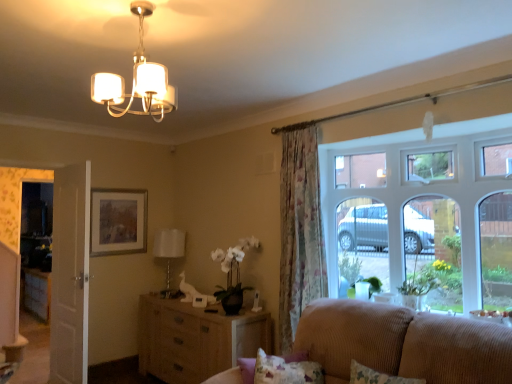
Identify the location of woven wood dresser at center. The height and width of the screenshot is (384, 512). 196,339.

What do you see at coordinates (118, 221) in the screenshot? This screenshot has width=512, height=384. I see `wooden picture frame at upper left` at bounding box center [118, 221].

What is the approximate height of matte white chandelier at upper center, the 2th lamp in the left-to-right sequence?

matte white chandelier at upper center, the 2th lamp in the left-to-right sequence, is 48.20 centimeters in height.

This screenshot has height=384, width=512. What are the coordinates of `clear glass window at center` in the screenshot? It's located at (401, 176).

Identify the location of transparent glass door at left. (36, 225).

Considering the relative sizes of white wooden door at left and clear glass window at center in the image provided, is white wooden door at left thinner than clear glass window at center?

Correct, the width of white wooden door at left is less than that of clear glass window at center.

Is white wooden door at left further to camera compared to clear glass window at center?

Yes.

Is white wooden door at left positioned beyond the bounds of clear glass window at center?

Yes.

Looking at this image, is white wooden door at left facing away from clear glass window at center?

No, white wooden door at left is not facing away from clear glass window at center.

From the picture: How different are the orientations of fluffy fabric pillow at lower right and matte white chandelier at upper center, the first lamp viewed from the top, in degrees?

94.2 degrees.

Visually, is fluffy fabric pillow at lower right positioned to the left or to the right of matte white chandelier at upper center, positioned as the 2th lamp in back-to-front order?

In the image, fluffy fabric pillow at lower right appears on the right side of matte white chandelier at upper center, positioned as the 2th lamp in back-to-front order.

Looking at this image, is matte white chandelier at upper center, the 2th lamp in the left-to-right sequence, surrounded by fluffy fabric pillow at lower right?

No.

From the image's perspective, is fluffy fabric pillow at lower right on matte white chandelier at upper center, the first lamp viewed from the top?

Incorrect, from the image's perspective, fluffy fabric pillow at lower right is lower than matte white chandelier at upper center, the first lamp viewed from the top.

This screenshot has height=384, width=512. I want to click on studio couch that is on the right side of wooden picture frame at upper left, so click(x=403, y=343).

How different are the orientations of beige corduroy couch at lower right and wooden picture frame at upper left in degrees?

The facing directions of beige corduroy couch at lower right and wooden picture frame at upper left are 89.8 degrees apart.

Is the depth of beige corduroy couch at lower right greater than that of wooden picture frame at upper left?

No, it is not.

Is beige corduroy couch at lower right shorter than wooden picture frame at upper left?

Incorrect, the height of beige corduroy couch at lower right does not fall short of that of wooden picture frame at upper left.

From the image's perspective, is transparent glass door at left above or below wooden picture frame at upper left?

Based on their image positions, transparent glass door at left is located beneath wooden picture frame at upper left.

Based on their sizes in the image, would you say transparent glass door at left is bigger or smaller than wooden picture frame at upper left?

transparent glass door at left is bigger than wooden picture frame at upper left.

Which of these two, transparent glass door at left or wooden picture frame at upper left, is wider?

transparent glass door at left is wider.

Which is in front, point (30, 217) or point (141, 204)?

The point (141, 204) is more forward.

Is beige corduroy couch at lower right at the left side of matte white chandelier at upper center, arranged as the second lamp when ordered from the bottom?

Incorrect, beige corduroy couch at lower right is not on the left side of matte white chandelier at upper center, arranged as the second lamp when ordered from the bottom.

Is point (226, 371) positioned before point (144, 109)?

No, it is behind (144, 109).

From the image's perspective, is beige corduroy couch at lower right above matte white chandelier at upper center, positioned as the 2th lamp in back-to-front order?

Actually, beige corduroy couch at lower right appears below matte white chandelier at upper center, positioned as the 2th lamp in back-to-front order, in the image.

Is beige corduroy couch at lower right positioned beyond the bounds of matte white chandelier at upper center, placed as the first lamp when sorted from front to back?

Yes, beige corduroy couch at lower right is outside of matte white chandelier at upper center, placed as the first lamp when sorted from front to back.

Is point (291, 148) positioned behind point (394, 383)?

Yes.

From a real-world perspective, is floral fabric curtain at center under fluffy fabric pillow at lower right?

Incorrect, from a real-world perspective, floral fabric curtain at center is higher than fluffy fabric pillow at lower right.

Is floral fabric curtain at center wider than fluffy fabric pillow at lower right?

Yes, floral fabric curtain at center is wider than fluffy fabric pillow at lower right.

Is fluffy fabric pillow at lower right at the back of floral fabric curtain at center?

That's not correct — floral fabric curtain at center is not looking away from fluffy fabric pillow at lower right.

How far apart are matte white chandelier at upper center, arranged as the second lamp when ordered from the bottom, and transparent glass door at left?

matte white chandelier at upper center, arranged as the second lamp when ordered from the bottom, is 3.56 meters away from transparent glass door at left.

Considering the relative positions of matte white chandelier at upper center, arranged as the second lamp when ordered from the bottom, and transparent glass door at left in the image provided, is matte white chandelier at upper center, arranged as the second lamp when ordered from the bottom, to the right of transparent glass door at left from the viewer's perspective?

Indeed, matte white chandelier at upper center, arranged as the second lamp when ordered from the bottom, is positioned on the right side of transparent glass door at left.

Locate an element on the screen. lamp above the transparent glass door at left (from a real-world perspective) is located at coordinates (137, 80).

Is matte white chandelier at upper center, arranged as the second lamp when ordered from the bottom, smaller than transparent glass door at left?

Yes.

Where is `door on the left of clear glass window at center`? The width and height of the screenshot is (512, 384). door on the left of clear glass window at center is located at coordinates (70, 275).

You are a GUI agent. You are given a task and a screenshot of the screen. Output one action in this format:
    pyautogui.click(x=<x>, y=<y>)
    Task: Click on the pillow behind the matte white chandelier at upper center, placed as the first lamp when sorted from front to back
    The width and height of the screenshot is (512, 384).
    Given the screenshot: What is the action you would take?
    pyautogui.click(x=376, y=376)

Based on the photo, looking at the image, which one is located closer to fluffy fabric pillow at lower right, transparent glass door at left or floral fabric curtain at center?

floral fabric curtain at center is positioned closer to the anchor fluffy fabric pillow at lower right.

Estimate the real-world distances between objects in this image. Which object is further from transparent glass door at left, fluffy fabric pillow at lower right or clear glass window at center?

fluffy fabric pillow at lower right is positioned further to the anchor transparent glass door at left.

Consider the image. Considering their positions, is woven wood dresser at center positioned closer to wooden picture frame at upper left than beige corduroy couch at lower right?

Among the two, woven wood dresser at center is located nearer to wooden picture frame at upper left.

Looking at the image, which one is located further to matte white chandelier at upper center, the first lamp viewed from the top, white wooden door at left or wooden picture frame at upper left?

wooden picture frame at upper left.

Looking at this image, estimate the real-world distances between objects in this image. Which object is further from woven wood dresser at center, white wooden door at left or matte white chandelier at upper center, which is counted as the 1th lamp, starting from the right?

matte white chandelier at upper center, which is counted as the 1th lamp, starting from the right, is positioned further to the anchor woven wood dresser at center.

Looking at the image, which one is located closer to woven wood dresser at center, floral fabric curtain at center or white wooden door at left?

floral fabric curtain at center is closer to woven wood dresser at center.

Based on their spatial positions, is beige corduroy couch at lower right or fluffy fabric pillow at lower right closer to floral fabric curtain at center?

beige corduroy couch at lower right is closer to floral fabric curtain at center.

Which object lies nearer to the anchor point white glass lamp at center, positioned as the first lamp in bottom-to-top order, fluffy fabric pillow at lower right or transparent glass door at left?

Based on the image, transparent glass door at left appears to be nearer to white glass lamp at center, positioned as the first lamp in bottom-to-top order.

At what (x,y) coordinates should I click in order to perform the action: click on cabinetry between beige corduroy couch at lower right and white glass lamp at center, which is counted as the first lamp, starting from the left, from front to back. Please return your answer as a coordinate pair (x, y). Looking at the image, I should click on (196, 339).

I want to click on picture frame between white wooden door at left and white glass lamp at center, acting as the 2th lamp starting from the front, along the z-axis, so click(x=118, y=221).

The width and height of the screenshot is (512, 384). Identify the location of door between matte white chandelier at upper center, placed as the first lamp when sorted from front to back, and transparent glass door at left, along the z-axis. (70, 275).

Find the location of a particular element. The height and width of the screenshot is (384, 512). pillow between matte white chandelier at upper center, which is counted as the 1th lamp, starting from the right, and transparent glass door at left in the front-back direction is located at coordinates (376, 376).